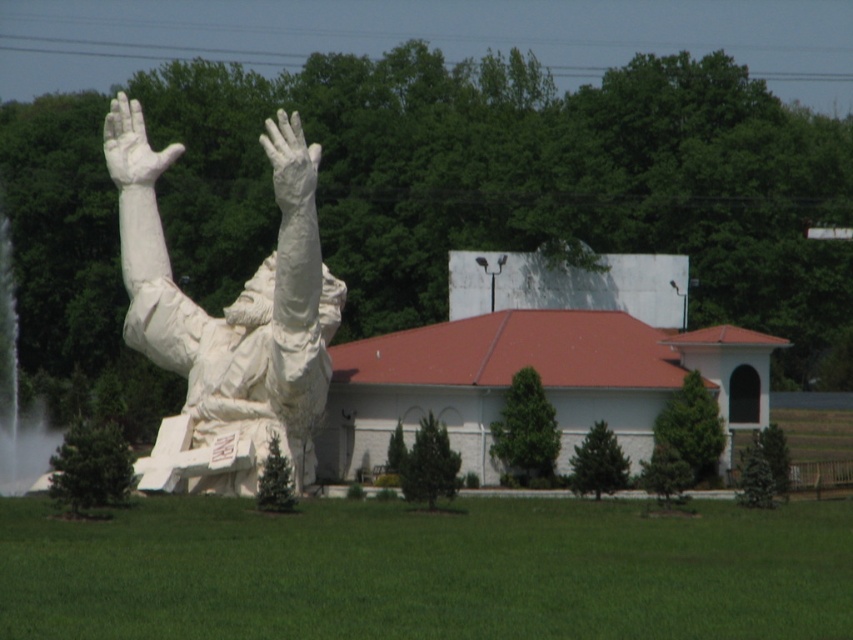
Which is above, white frothy water at left or white marble hand at upper center?

white marble hand at upper center is above.

Measure the distance between white frothy water at left and white marble hand at upper center.

white frothy water at left is 52.61 feet away from white marble hand at upper center.

Which is behind, point (4, 317) or point (288, 186)?

The point (4, 317) is more distant.

Identify the location of white frothy water at left. The height and width of the screenshot is (640, 853). (16, 392).

Can you confirm if white stone hand at upper center is bigger than white marble hand at upper center?

Indeed, white stone hand at upper center has a larger size compared to white marble hand at upper center.

Is point (107, 145) positioned in front of point (286, 125)?

No, it is not.

This screenshot has width=853, height=640. Describe the element at coordinates (132, 145) in the screenshot. I see `white stone hand at upper center` at that location.

Locate an element on the screen. The image size is (853, 640). white stone hand at upper center is located at coordinates (132, 145).

Is the position of white marble statue at center less distant than that of white marble hand at upper center?

Yes, white marble statue at center is closer to the viewer.

Between point (143, 140) and point (300, 131), which one is positioned behind?

The point (143, 140) is more distant.

The width and height of the screenshot is (853, 640). I want to click on white marble statue at center, so (229, 317).